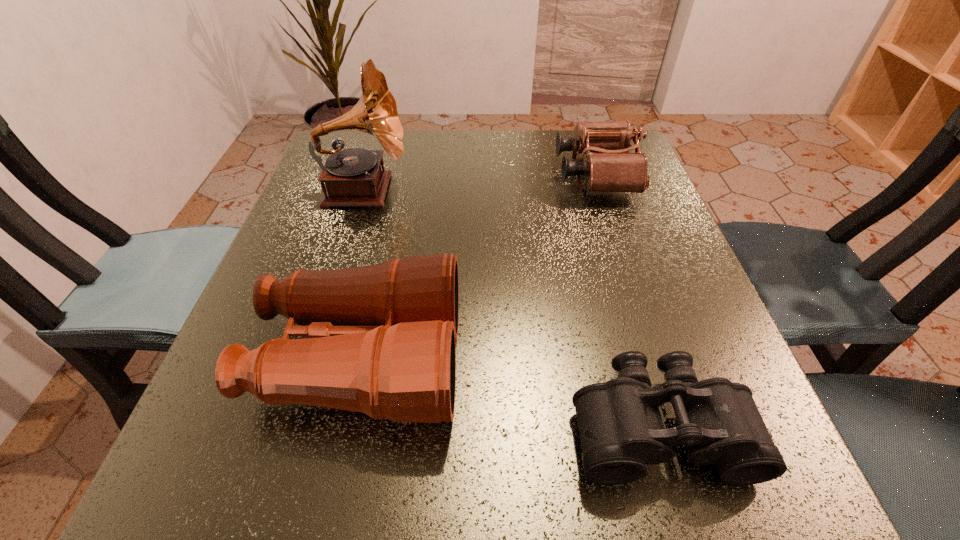
Image resolution: width=960 pixels, height=540 pixels. Find the location of `the tallest object`. the tallest object is located at coordinates 353,177.

At what (x,y) coordinates should I click in order to perform the action: click on the tallest binoculars. Please return your answer as a coordinate pair (x, y). The height and width of the screenshot is (540, 960). Looking at the image, I should click on [381, 341].

This screenshot has width=960, height=540. I want to click on the leftmost binoculars, so click(381, 341).

Where is `the farthest binoculars`? the farthest binoculars is located at coordinates (608, 166).

The width and height of the screenshot is (960, 540). What are the coordinates of `the third tallest object` in the screenshot? It's located at (608, 166).

At what (x,y) coordinates should I click in order to perform the action: click on the shortest object. Please return your answer as a coordinate pair (x, y). Looking at the image, I should click on (621, 431).

Find the location of `vacant space located on the horn of the tallest object`. vacant space located on the horn of the tallest object is located at coordinates (464, 190).

In order to click on vacant space located 0.330m through the lenses of the leftmost binoculars in this screenshot , I will do `click(680, 360)`.

The width and height of the screenshot is (960, 540). Find the location of `vacant space located 0.280m through the eyepieces of the second tallest binoculars`. vacant space located 0.280m through the eyepieces of the second tallest binoculars is located at coordinates (434, 174).

The height and width of the screenshot is (540, 960). In order to click on free region located through the eyepieces of the second tallest binoculars in this screenshot , I will do `click(483, 174)`.